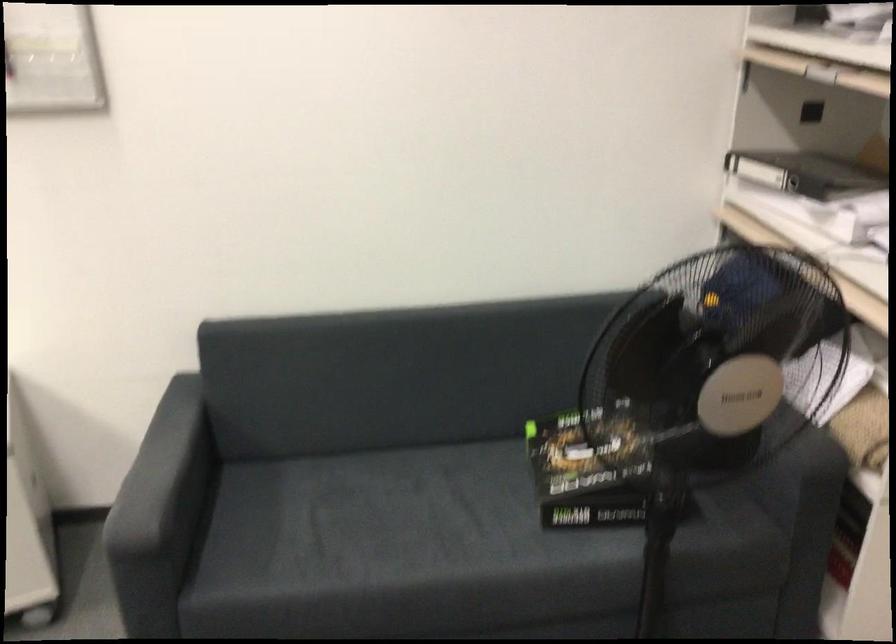
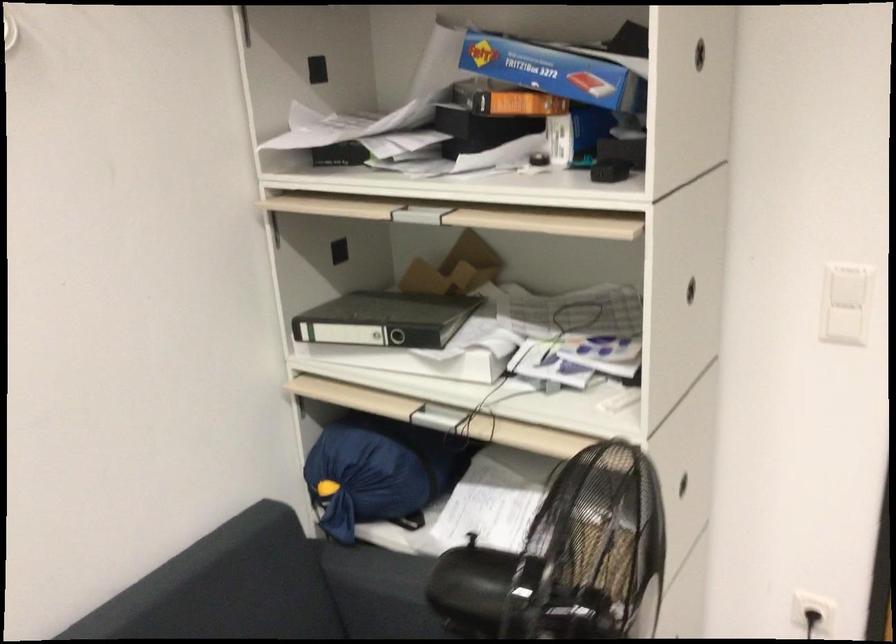
Find the pixel in the second image that matches (x=791, y=167) in the first image.

(385, 319)